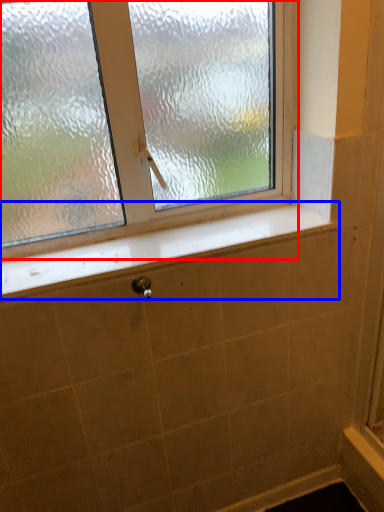
Question: Which object appears closest to the camera in this image, window (highlighted by a red box) or window sill (highlighted by a blue box)?

Choices:
 (A) window
 (B) window sill

Answer: (A)